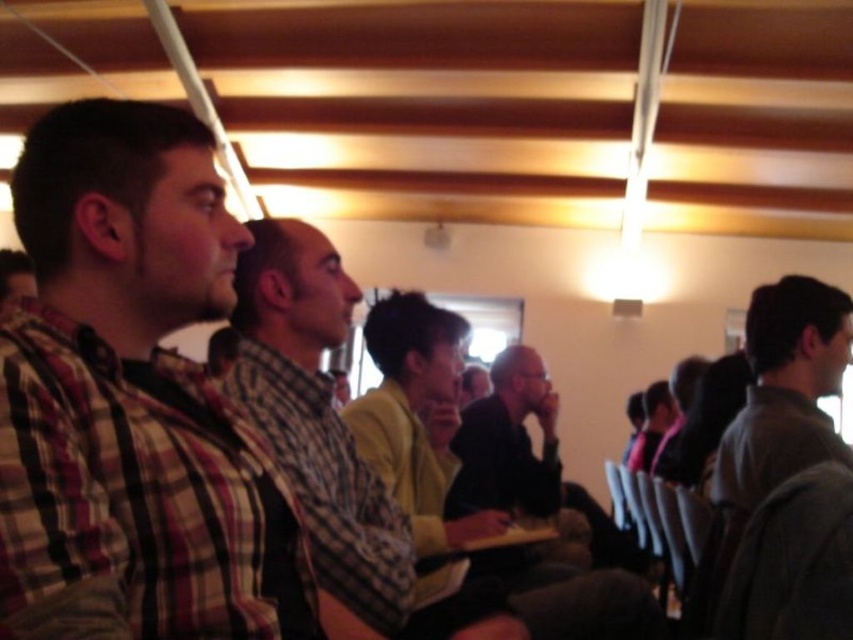
Question: Can you confirm if plaid shirt at left is positioned to the left of plaid shirt at center?

Choices:
 (A) yes
 (B) no

Answer: (A)

Question: Which of the following is the closest to the observer?

Choices:
 (A) plaid shirt at center
 (B) dark gray sweater at right

Answer: (A)

Question: Can you confirm if plaid shirt at center is bigger than dark gray sweater at right?

Choices:
 (A) yes
 (B) no

Answer: (B)

Question: Based on their relative distances, which object is nearer to the plaid shirt at left?

Choices:
 (A) dark gray sweater at right
 (B) plaid shirt at center

Answer: (B)

Question: Which point is farther from the camera taking this photo?

Choices:
 (A) (792, 438)
 (B) (143, 387)

Answer: (A)

Question: Does plaid shirt at left have a larger size compared to dark gray sweater at right?

Choices:
 (A) yes
 (B) no

Answer: (B)